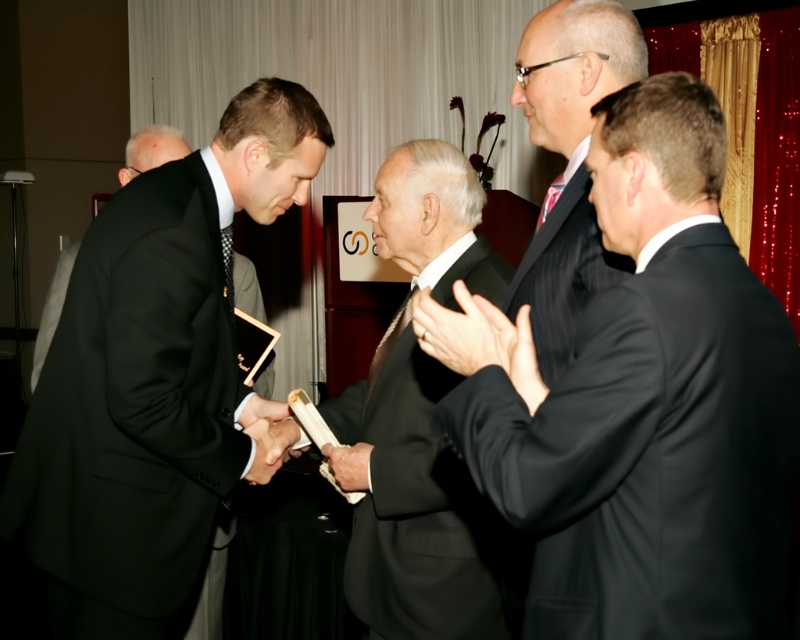
You are an event planner organizing a formal ceremony. You need to ensure that the award recipient can comfortably receive the certificate. Given the black pinstripe suit at right and the smooth black glove at center, which object should the recipient wear to ensure the certificate fits properly?

The black pinstripe suit at right has a larger size compared to the smooth black glove at center, so the recipient should wear the black pinstripe suit at right to ensure the certificate fits properly.

You are a photographer at the event. You need to capture a photo where both the black pinstripe suit at right and the smooth black glove at center are visible. Which object should be placed closer to the camera to ensure both are in frame without cropping?

The smooth black glove at center should be placed closer to the camera because the black pinstripe suit at right is taller than the smooth black glove at center. By positioning the shorter object closer, both will fit within the frame without cropping.